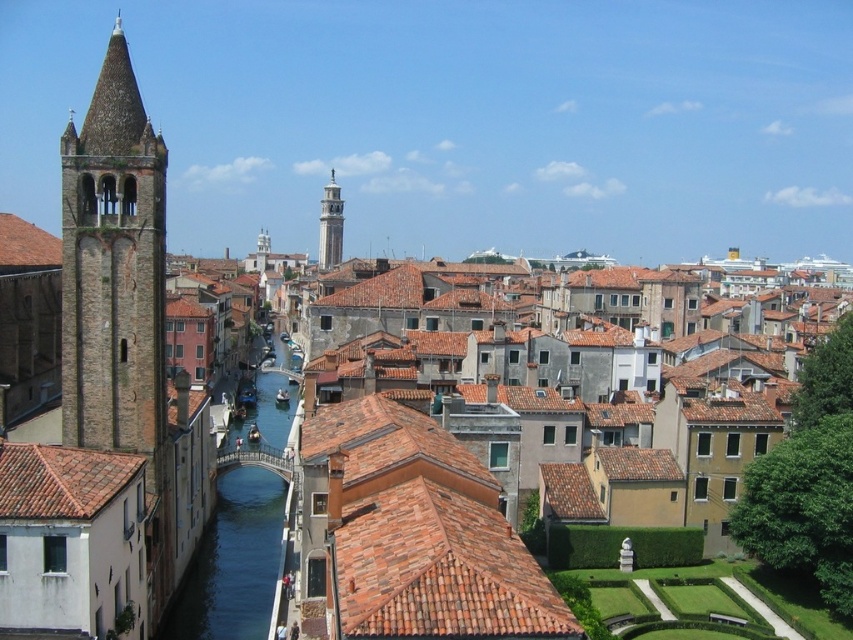
Question: Which of the following is the farthest from the observer?

Choices:
 (A) blue smooth water at center
 (B) brown tile roof at left

Answer: (B)

Question: Which point is closer to the camera?

Choices:
 (A) (329, 225)
 (B) (596, 472)
 (C) (30, 257)

Answer: (B)

Question: Does brown tile roof at lower left come in front of brown tile roof at left?

Choices:
 (A) no
 (B) yes

Answer: (B)

Question: Where is brown tile roof at center located in relation to smooth white tower at center in the image?

Choices:
 (A) below
 (B) above

Answer: (A)

Question: Is brown tile roof at center above smooth white tower at center?

Choices:
 (A) no
 (B) yes

Answer: (A)

Question: Which point is closer to the camera?

Choices:
 (A) (247, 493)
 (B) (152, 307)
 (C) (10, 264)

Answer: (B)